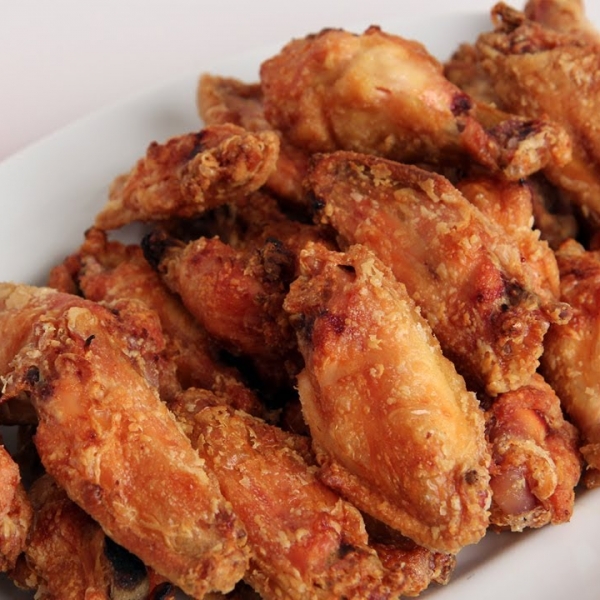
Locate an element on the screen. Image resolution: width=600 pixels, height=600 pixels. table or counter is located at coordinates [55, 64].